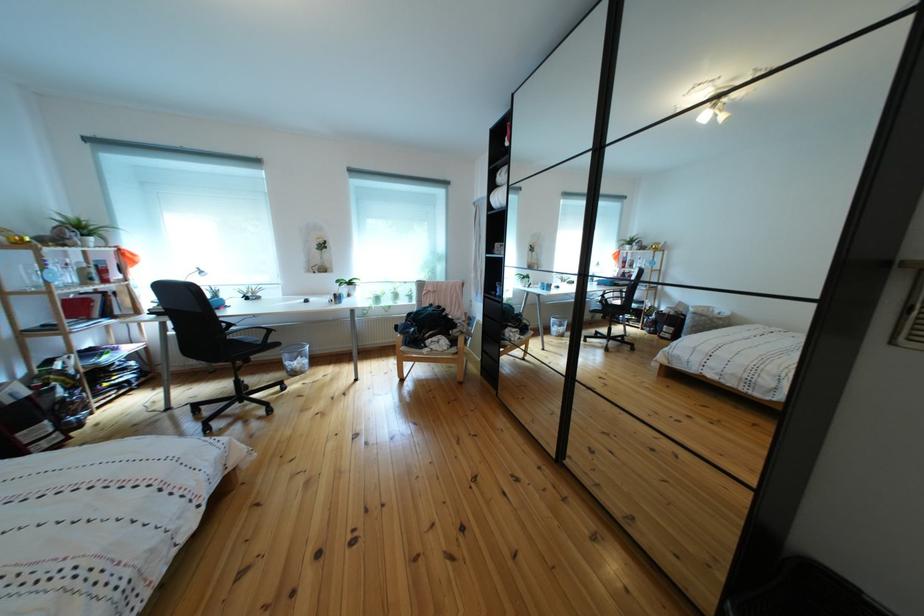
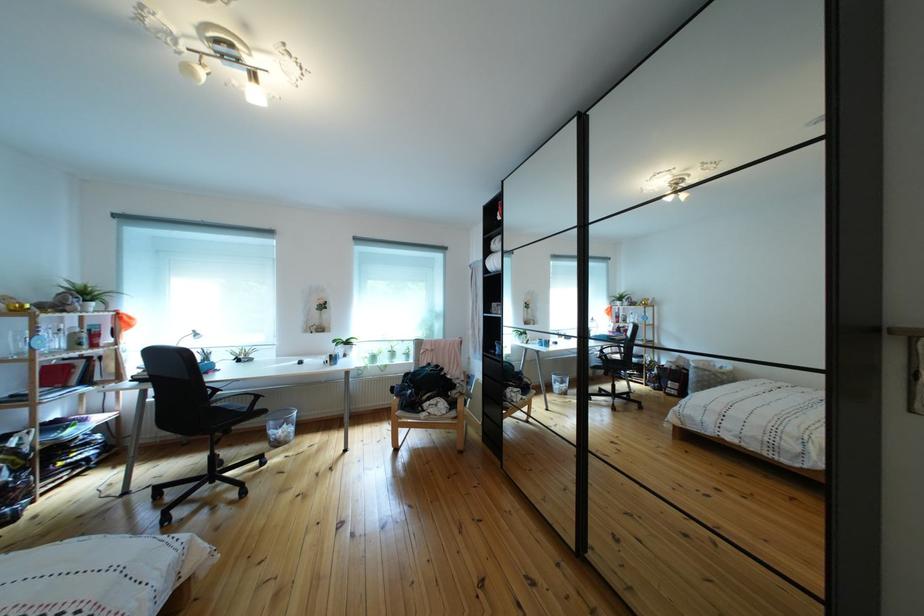
Find the pixel in the second image that matches (x=241, y=342) in the first image.

(225, 411)